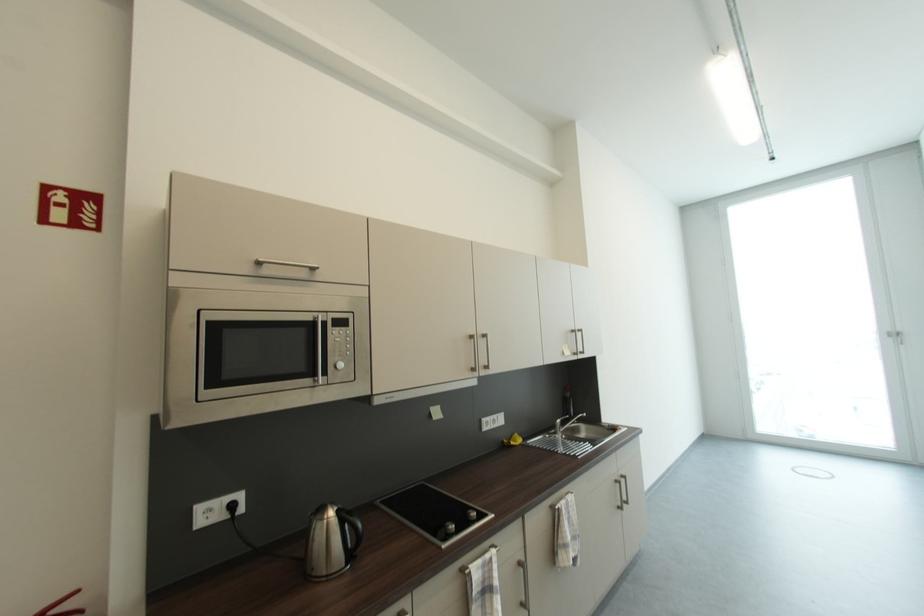
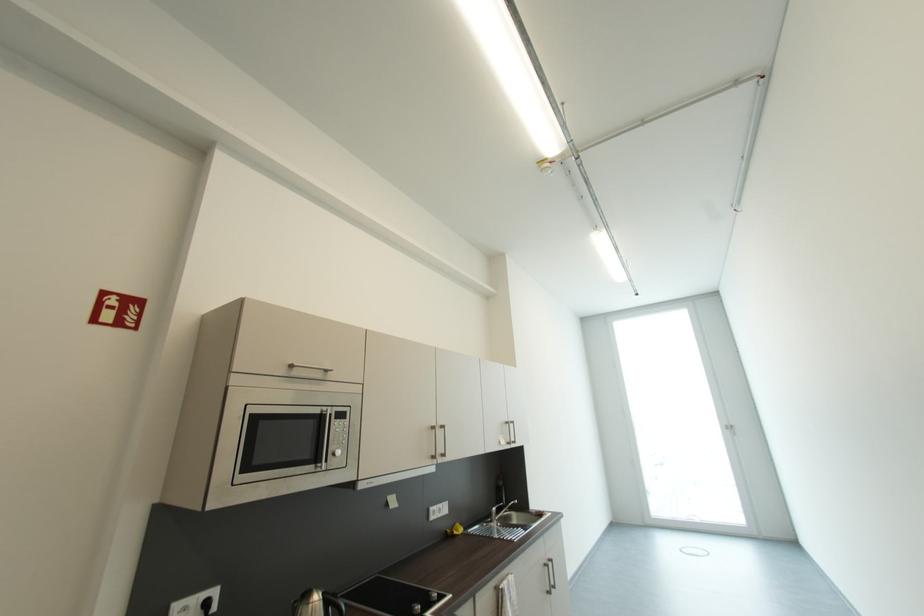
Locate, in the second image, the point that corresponds to [480,368] in the first image.

(440, 456)